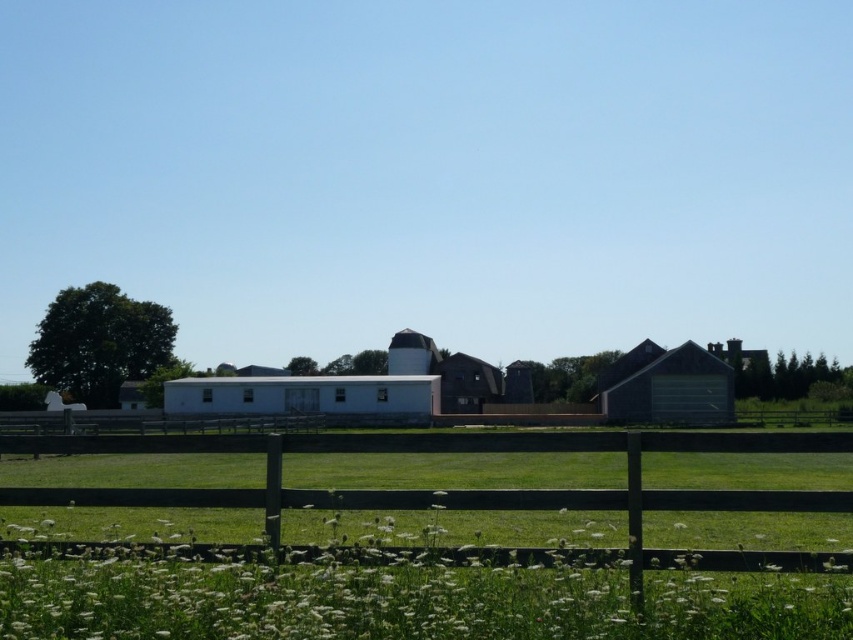
You are standing in the field and looking towards the barns. Which barn is closer to you, the white matte barn at center or the green corrugated metal barn at right?

The white matte barn at center is closer to you because it is positioned under the green corrugated metal barn at right, indicating it is in front.

You are standing at the fence in the image and want to walk to the green corrugated metal barn at right. Which direction should you head relative to the white matte barn at center?

You should head to the right of the white matte barn at center to reach the green corrugated metal barn at right.

From the picture: You are standing in the field and looking towards the barns. Which barn is closer to you, the white matte barn at center or the green corrugated metal barn at right?

The white matte barn at center is closer to you because it is in front of the green corrugated metal barn at right.